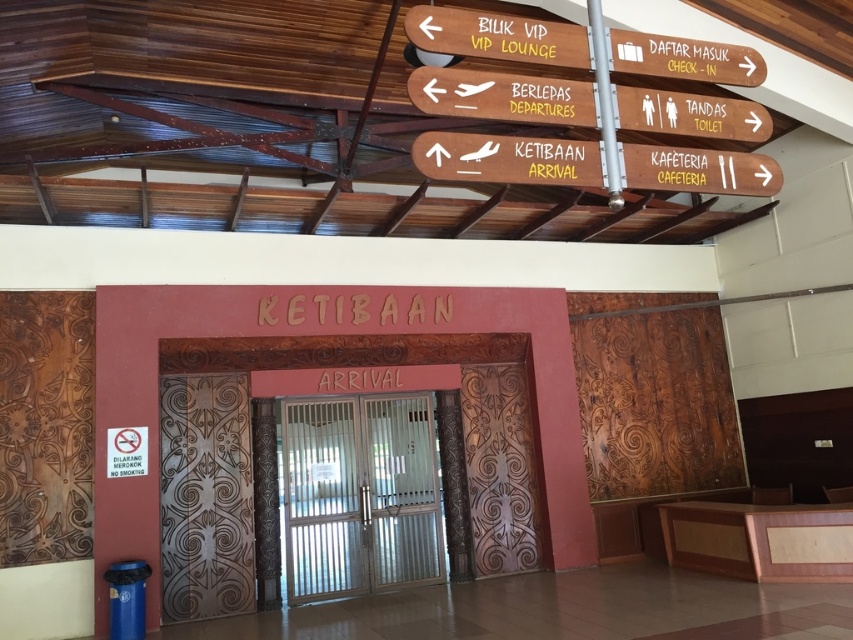
You are a traveler at the airport terminal and want to reach the elevator to go to the VIP lounge. You see the white metal elevator at center and the yellow painted wooden sign at upper center. Which object is bigger in size?

The white metal elevator at center is larger in size compared to the yellow painted wooden sign at upper center.

You are a traveler with a heavy suitcase. You see the white metal elevator at center and the silver metallic pole at upper center. Which object is bigger in size?

The white metal elevator at center is larger in size compared to the silver metallic pole at upper center.